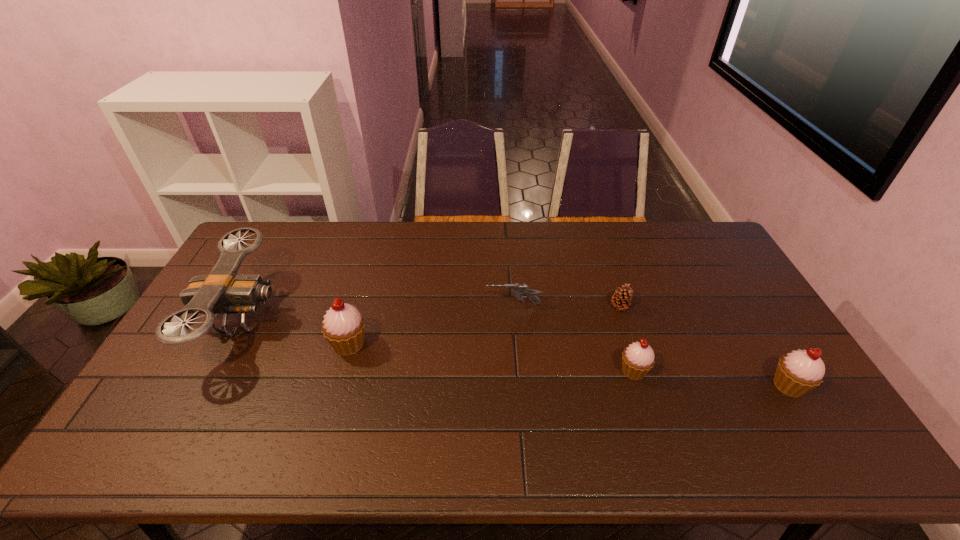
What are the coordinates of `free location that satisfies the following two spatial constraints: 1. at the barrel of the gun; 2. on the right side of the pinecone` in the screenshot? It's located at (514, 307).

In order to click on vacant area that satisfies the following two spatial constraints: 1. on the front-facing side of the leftmost object; 2. on the right side of the second cupcake from left to right in this screenshot , I will do `click(214, 371)`.

Where is `vacant region that satisfies the following two spatial constraints: 1. on the front-facing side of the leftmost cupcake; 2. on the left side of the drone`? Image resolution: width=960 pixels, height=540 pixels. vacant region that satisfies the following two spatial constraints: 1. on the front-facing side of the leftmost cupcake; 2. on the left side of the drone is located at coordinates (228, 344).

The image size is (960, 540). What are the coordinates of `free location that satisfies the following two spatial constraints: 1. on the front-facing side of the leftmost object; 2. on the back side of the second cupcake from left to right` in the screenshot? It's located at (214, 371).